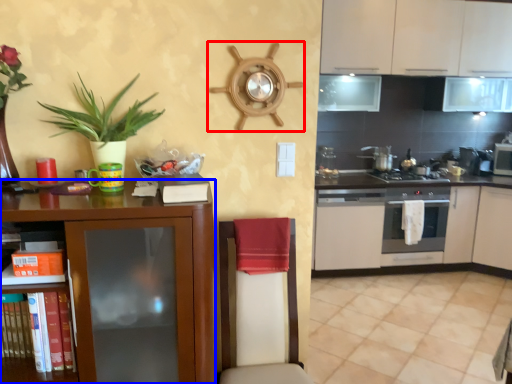
Question: Which object is further to the camera taking this photo, appliance (highlighted by a red box) or cabinetry (highlighted by a blue box)?

Choices:
 (A) appliance
 (B) cabinetry

Answer: (A)